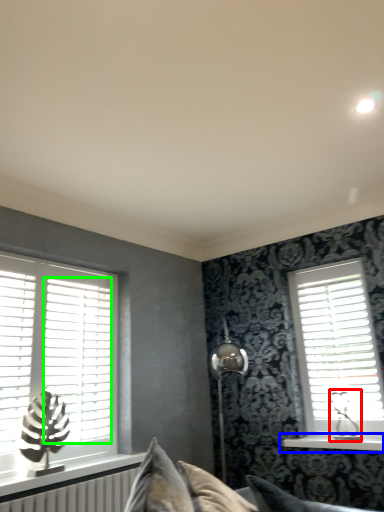
Question: Which object is positioned farthest from table lamp (highlighted by a red box)? Select from window sill (highlighted by a blue box) and blind (highlighted by a green box).

Choices:
 (A) window sill
 (B) blind

Answer: (B)